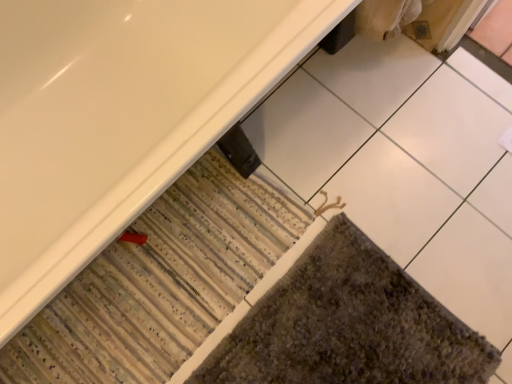
Question: Is textured gray bath mat at lower right, arranged as the 2th bath mat when viewed from the left, taller or shorter than striped carpet at lower left, the second bath mat from the right?

Choices:
 (A) tall
 (B) short

Answer: (B)

Question: Based on their positions, is textured gray bath mat at lower right, arranged as the 2th bath mat when viewed from the left, located to the left or right of striped carpet at lower left, which appears as the 1th bath mat when viewed from the left?

Choices:
 (A) right
 (B) left

Answer: (A)

Question: Which is farther from the striped carpet at lower left, which appears as the 1th bath mat when viewed from the left?

Choices:
 (A) textured gray bath mat at lower right, arranged as the 2th bath mat when viewed from the left
 (B) white glossy bathtub at lower left

Answer: (B)

Question: Based on their relative distances, which object is nearer to the white glossy bathtub at lower left?

Choices:
 (A) textured gray bath mat at lower right, marked as the 1th bath mat in a right-to-left arrangement
 (B) striped carpet at lower left, which appears as the 1th bath mat when viewed from the left

Answer: (B)